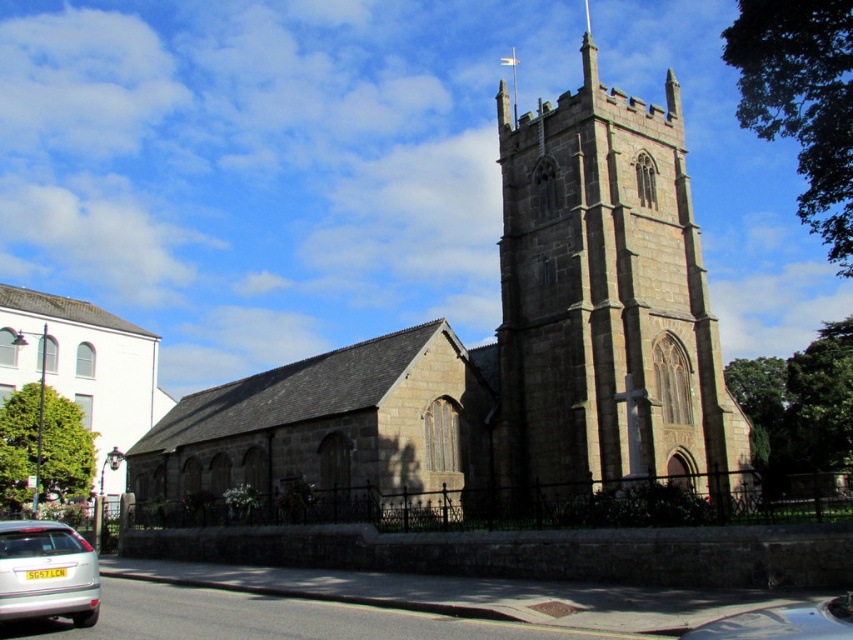
Question: Can you confirm if brown stone church at center is wider than silver metallic car at lower left?

Choices:
 (A) no
 (B) yes

Answer: (B)

Question: Based on their relative distances, which object is farther from the dark gray stone tower at center?

Choices:
 (A) metallic silver car at lower right
 (B) silver metallic car at lower left
 (C) white smooth building at left

Answer: (C)

Question: Which object is the farthest from the brown stone church at center?

Choices:
 (A) metallic silver car at lower right
 (B) dark gray stone tower at center
 (C) white smooth building at left

Answer: (A)

Question: Does brown stone church at center appear on the left side of dark gray stone tower at center?

Choices:
 (A) no
 (B) yes

Answer: (B)

Question: Does silver metallic car at lower left have a greater width compared to metallic silver car at lower right?

Choices:
 (A) no
 (B) yes

Answer: (A)

Question: Which point is farther to the camera?

Choices:
 (A) white smooth building at left
 (B) silver metallic car at lower left
 (C) dark gray stone tower at center

Answer: (A)